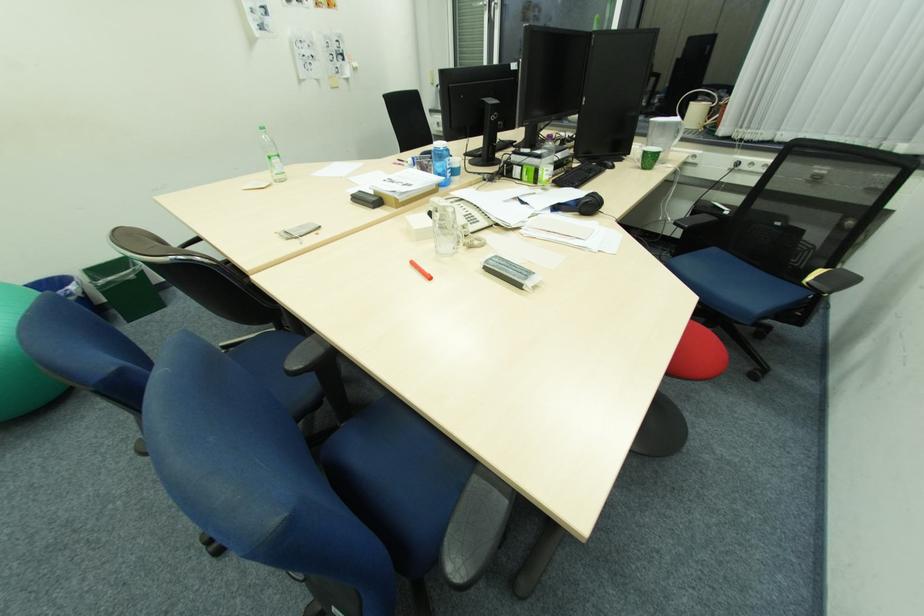
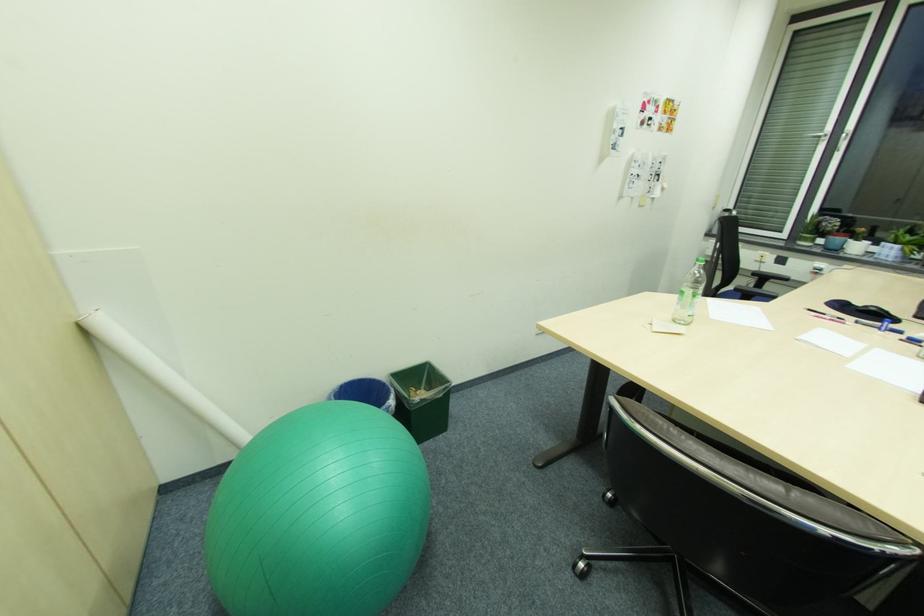
Find the pixel in the second image that matches point 287,180 in the first image.

(688, 323)